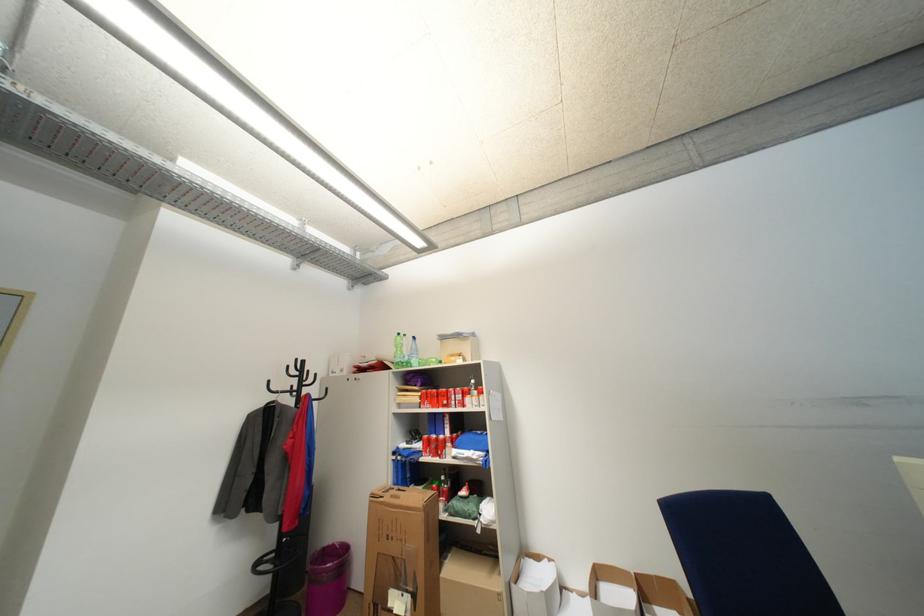
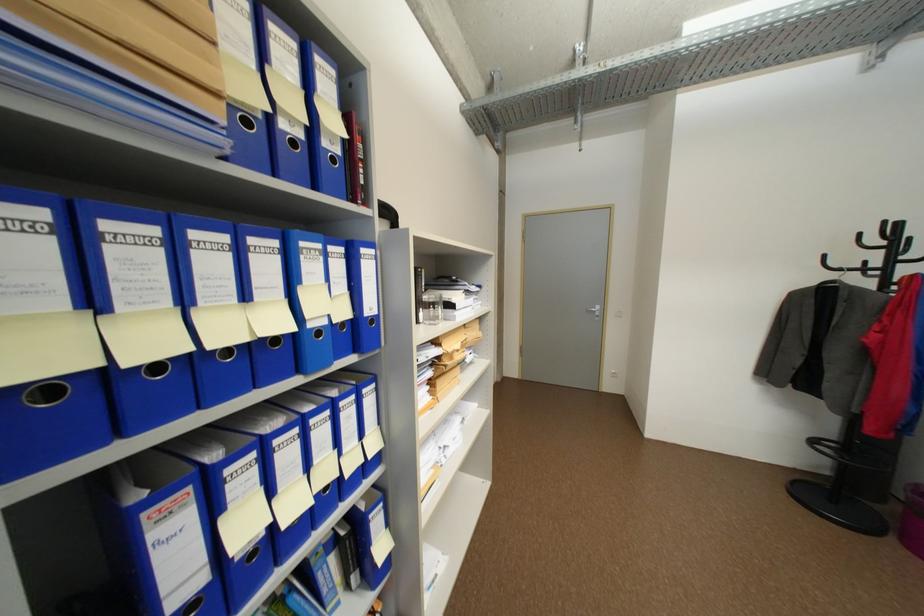
The point at [299,392] is marked in the first image. Where is the corresponding point in the second image?

(873, 270)